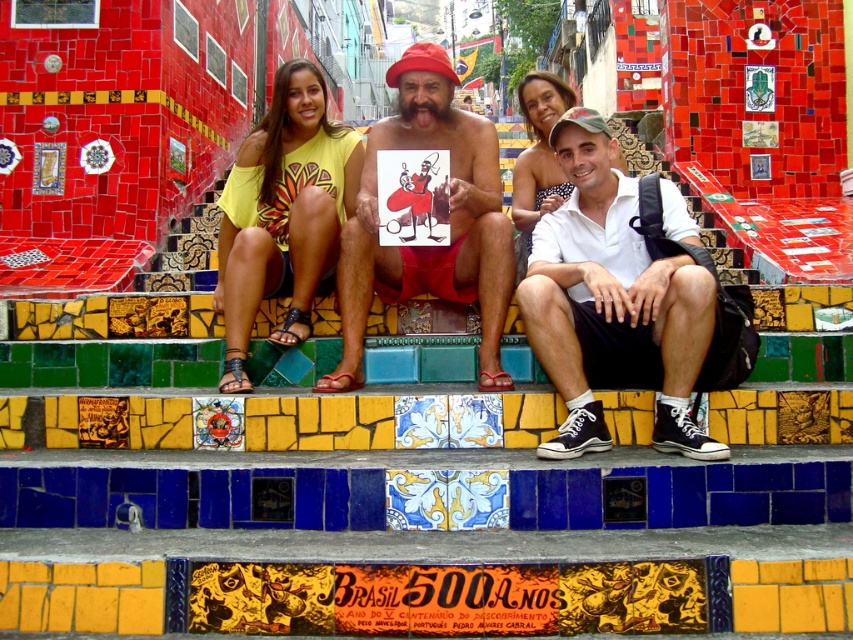
Between white cotton shirt at center and matte red shorts at center, which one is positioned higher?

matte red shorts at center is higher up.

Is white cotton shirt at center behind matte red shorts at center?

No, it is in front of matte red shorts at center.

Is point (671, 390) positioned before point (389, 145)?

Yes, point (671, 390) is in front of point (389, 145).

The width and height of the screenshot is (853, 640). I want to click on white cotton shirt at center, so click(x=612, y=301).

Does matte red shorts at center have a smaller size compared to yellow cotton shirt at center?

Actually, matte red shorts at center might be larger than yellow cotton shirt at center.

Is point (346, 296) positioned behind point (300, 292)?

No, it is not.

You are a GUI agent. You are given a task and a screenshot of the screen. Output one action in this format:
    pyautogui.click(x=<x>, y=<y>)
    Task: Click on the matte red shorts at center
    
    Given the screenshot: What is the action you would take?
    pyautogui.click(x=450, y=221)

Is white cotton shirt at center thinner than yellow cotton shirt at center?

No, white cotton shirt at center is not thinner than yellow cotton shirt at center.

Is point (567, 228) in front of point (289, 292)?

Yes.

Who is more distant from viewer, (637, 317) or (286, 84)?

Point (286, 84)

Identify the location of white cotton shirt at center. (612, 301).